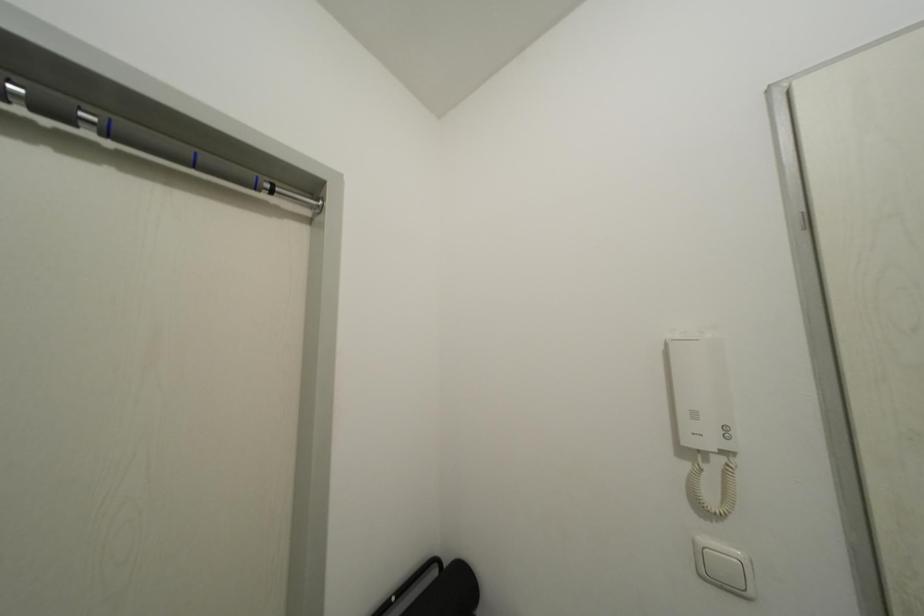
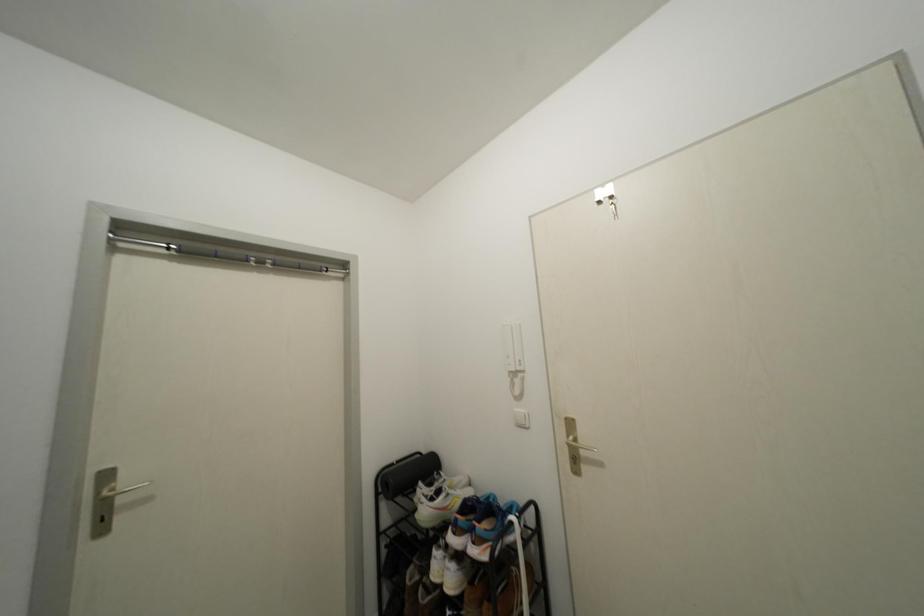
Question: How did the camera likely rotate?

Choices:
 (A) Left
 (B) Right
 (C) Up
 (D) Down

Answer: (A)